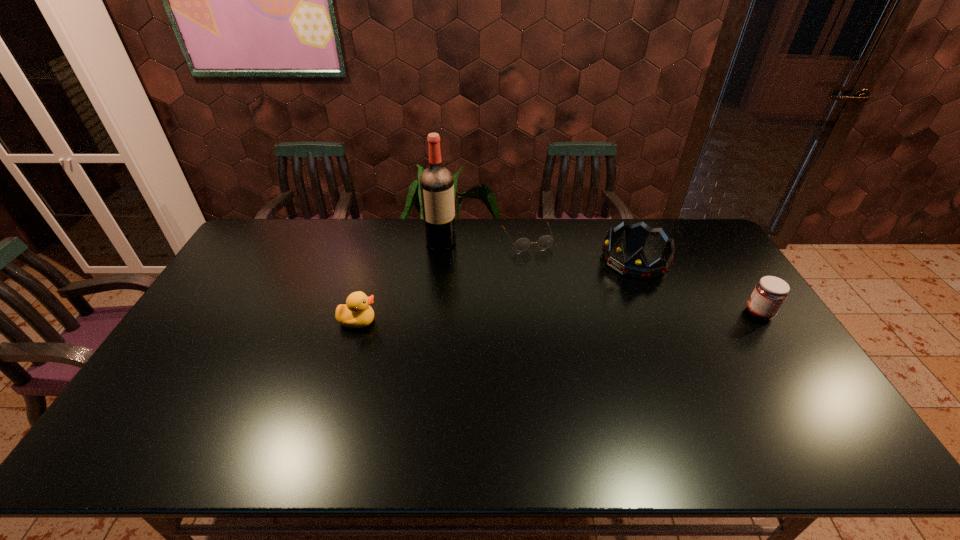
Locate an element on the screen. vacant space that satisfies the following two spatial constraints: 1. on the front side of the jam; 2. on the right side of the fourth shortest object is located at coordinates (658, 313).

Identify the location of vacant point that satisfies the following two spatial constraints: 1. on the front side of the second object from right to left; 2. on the right side of the third object from left to right. The width and height of the screenshot is (960, 540). (529, 259).